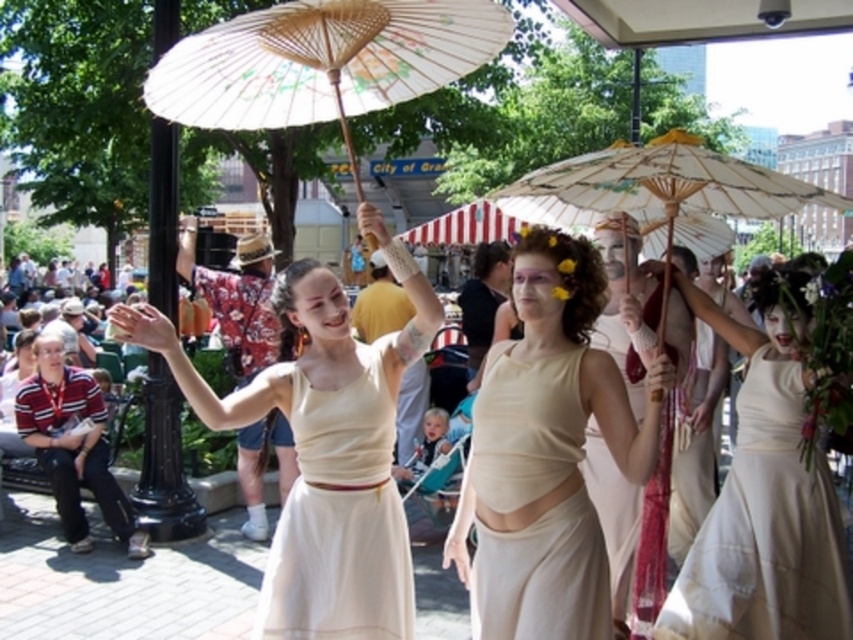
Question: Does white paper umbrella at upper center have a lesser width compared to white matte dress at center?

Choices:
 (A) yes
 (B) no

Answer: (B)

Question: Does matte cream dress at center lie in front of matte cream fabric dress at center?

Choices:
 (A) yes
 (B) no

Answer: (B)

Question: Which point is farther to the camera?

Choices:
 (A) (633, 166)
 (B) (322, 72)

Answer: (B)

Question: Is white cotton dress at center positioned at the back of white matte dress at center?

Choices:
 (A) no
 (B) yes

Answer: (B)

Question: Among these objects, which one is nearest to the camera?

Choices:
 (A) white matte dress at center
 (B) matte paper umbrella at upper center

Answer: (A)

Question: Among these objects, which one is nearest to the camera?

Choices:
 (A) white matte dress at center
 (B) matte paper umbrella at upper center
 (C) white cotton dress at center

Answer: (A)